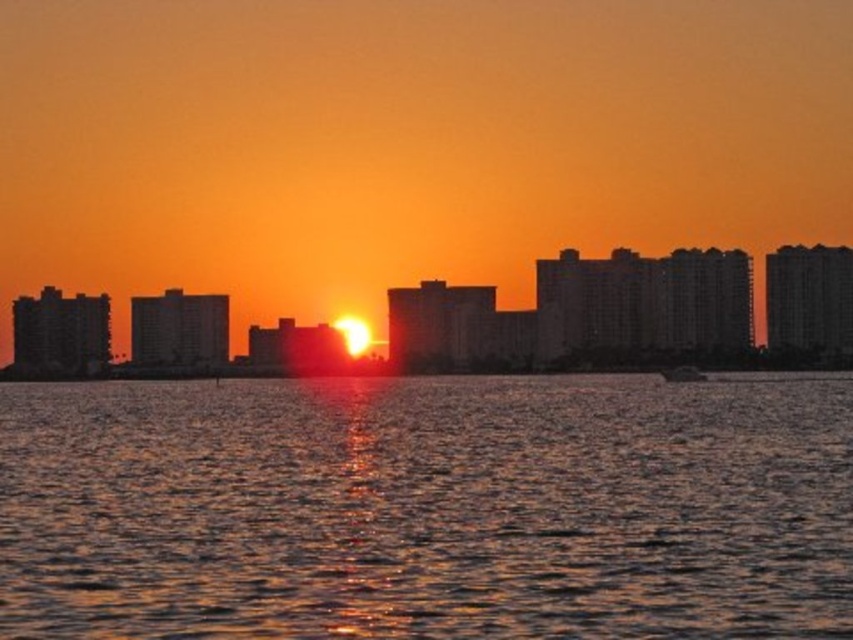
Image resolution: width=853 pixels, height=640 pixels. Describe the element at coordinates (426, 508) in the screenshot. I see `glistening water at center` at that location.

Based on the photo, who is more distant from viewer, (122, 422) or (567, 320)?

Positioned behind is point (122, 422).

Find the location of a particular element. glistening water at center is located at coordinates (426, 508).

Can you confirm if silky water at center is positioned to the left of metallic silver boat at center?

Yes, silky water at center is to the left of metallic silver boat at center.

Can you confirm if silky water at center is thinner than metallic silver boat at center?

Incorrect, silky water at center's width is not less than metallic silver boat at center's.

Who is more distant from viewer, (618, 298) or (668, 381)?

The point (668, 381) is behind.

What are the coordinates of `silky water at center` in the screenshot? It's located at (635, 314).

Based on the photo, is glistening water at center above metallic silver boat at center?

No, glistening water at center is not above metallic silver boat at center.

What do you see at coordinates (426, 508) in the screenshot? I see `glistening water at center` at bounding box center [426, 508].

Image resolution: width=853 pixels, height=640 pixels. What do you see at coordinates (426, 508) in the screenshot? I see `glistening water at center` at bounding box center [426, 508].

Locate an element on the screen. This screenshot has width=853, height=640. glistening water at center is located at coordinates (426, 508).